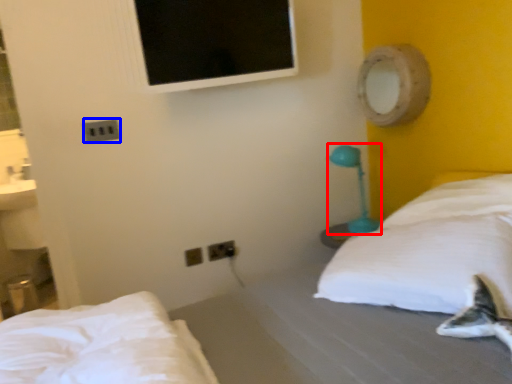
Question: Which of the following is the closest to the observer, table lamp (highlighted by a red box) or electric outlet (highlighted by a blue box)?

Choices:
 (A) table lamp
 (B) electric outlet

Answer: (B)